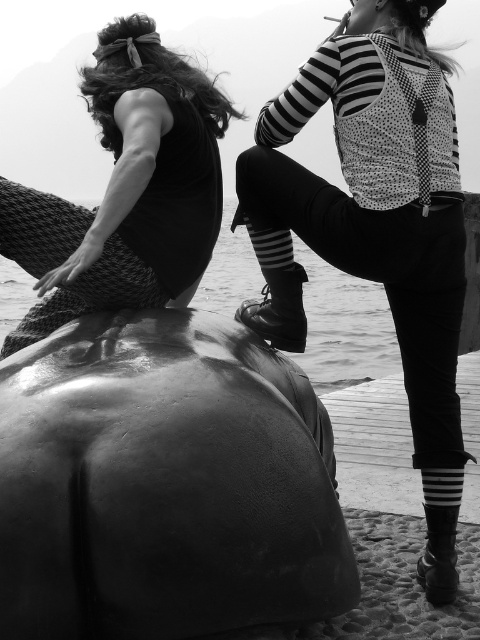
You are an art curator planning to move the shiny dark gray humpback whale at lower left and the polka dot fabric backpack at upper right to a new gallery space. The gallery has a 1.2 meter wide doorway. Given their sizes, will both items fit through the doorway when moved individually?

The shiny dark gray humpback whale at lower left has a smaller size compared to the polka dot fabric backpack at upper right. Since the doorway is 1.2 meters wide, both items can fit through individually as long as their widths are less than 1.2 meters. However, the exact dimensions of each item are not provided, so we cannot confirm if they will fit without additional information.

You are a photographer standing at the edge of the cobblestone surface near the water. You want to capture a photo of both the shiny dark gray humpback whale at lower left and the polka dot fabric backpack at upper right in the same frame. Given the distance between them, will you need to zoom out your camera lens to include both objects in the shot?

The distance between the shiny dark gray humpback whale at lower left and the polka dot fabric backpack at upper right is 1.12 meters. To include both objects in the same frame, you would need to zoom out your camera lens to accommodate the 1.12 meter separation between them.

You are standing in front of the sculpture and notice a polka dot fabric backpack at upper right. If you want to pick up the backpack without moving from your current position, is it within reach?

The polka dot fabric backpack at upper right is 11.85 feet away from viewer, so it is too far to reach without moving closer.